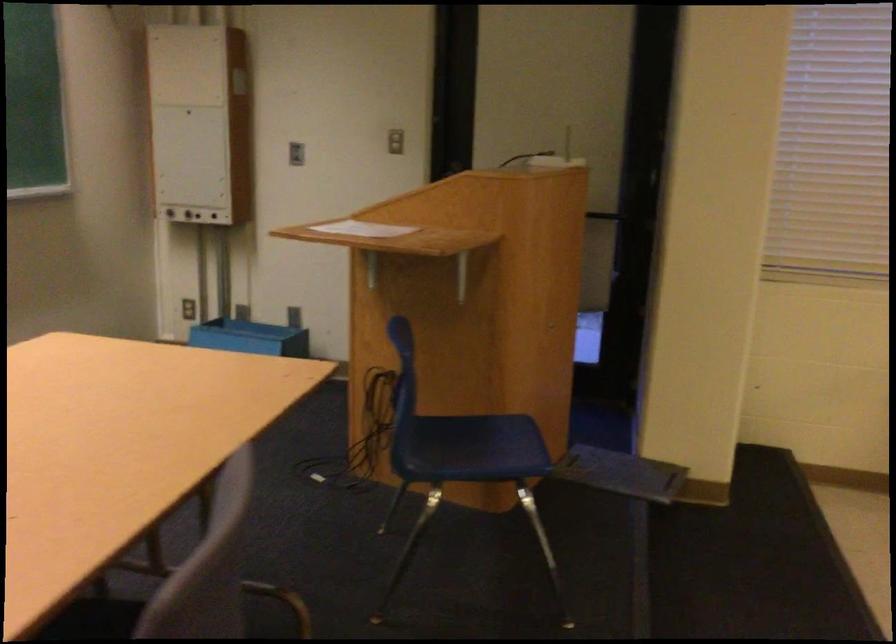
Find where to lift the white paper sheet. Please return your answer as a coordinate pair (x, y).

(362, 229)